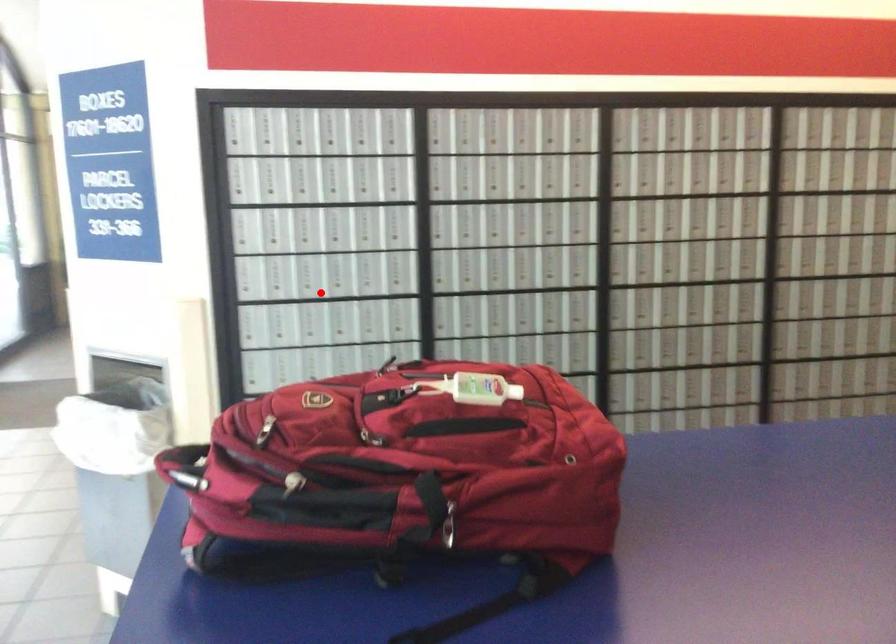
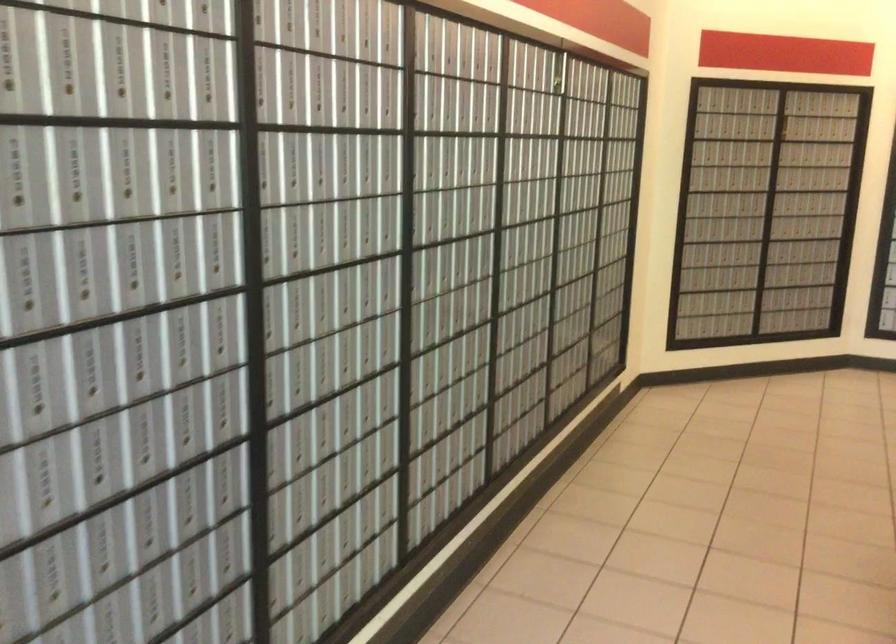
Find the pixel in the second image that matches the highlighted location in the first image.

(110, 313)